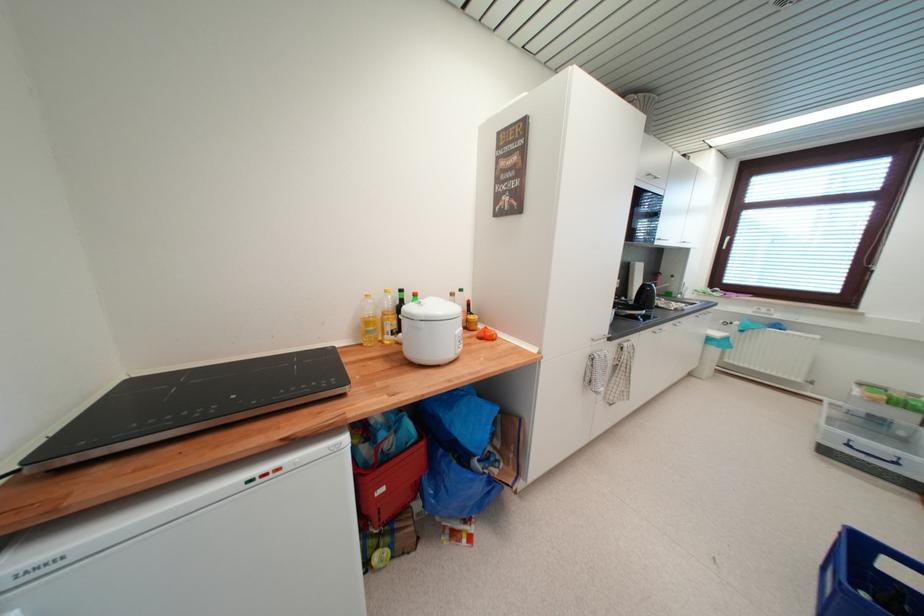
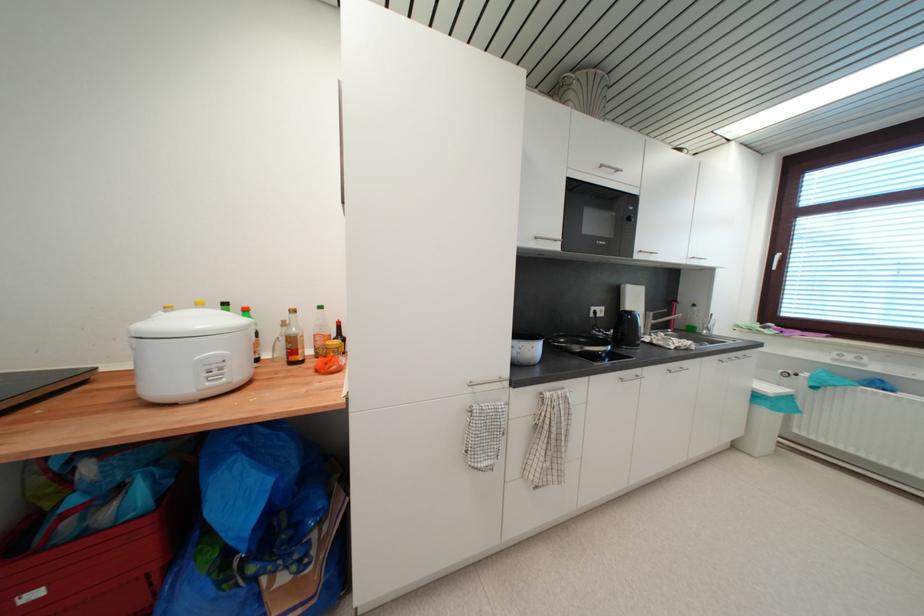
The images are taken continuously from a first-person perspective. In which direction are you moving?

The movement direction of the cameraman is right, forward.